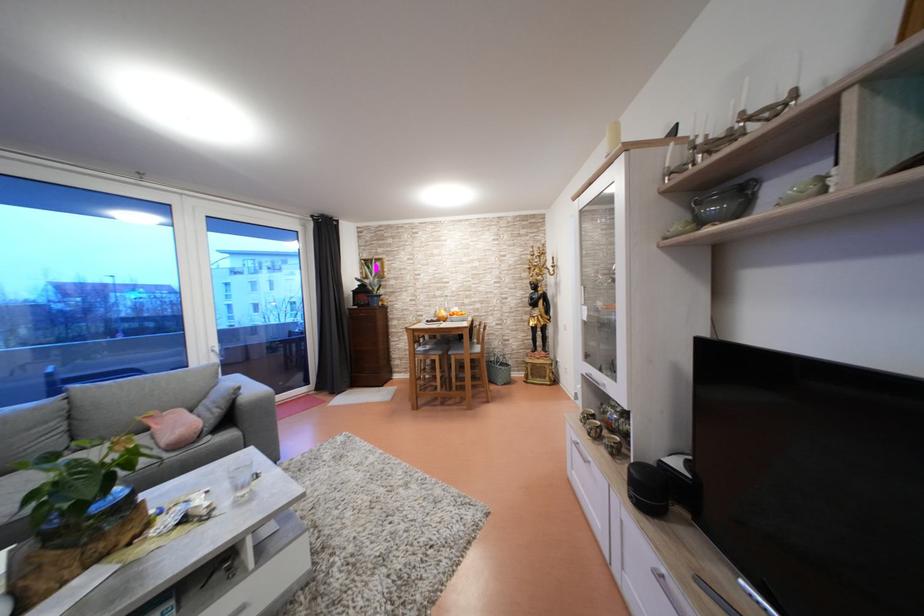
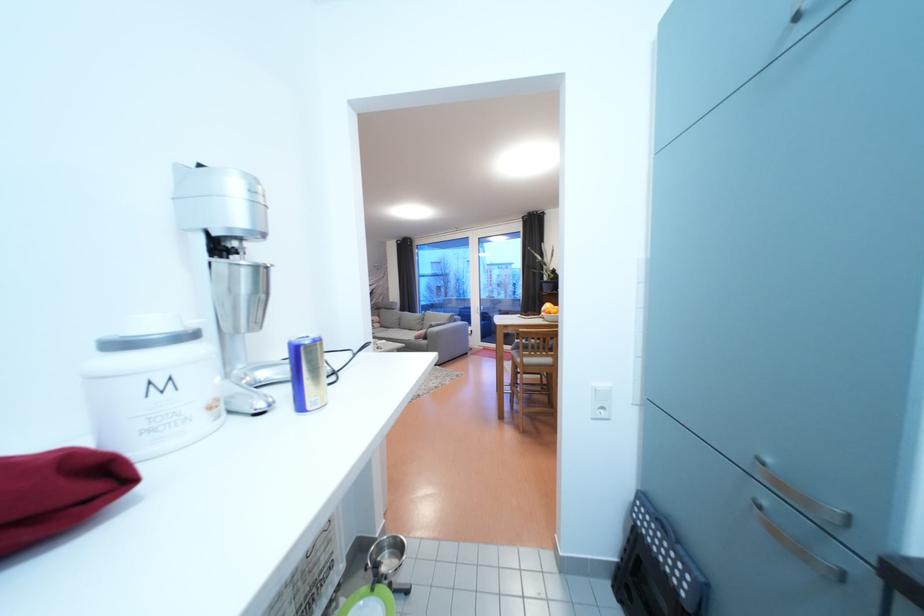
Question: I am providing you with two images of the same scene from different viewpoints. After the viewpoint changes to image2, which objects are now occluded?

Choices:
 (A) chair sitting surface
 (B) water bottle handle
 (C) metal scoop
 (D) green ceramic bowl

Answer: (D)